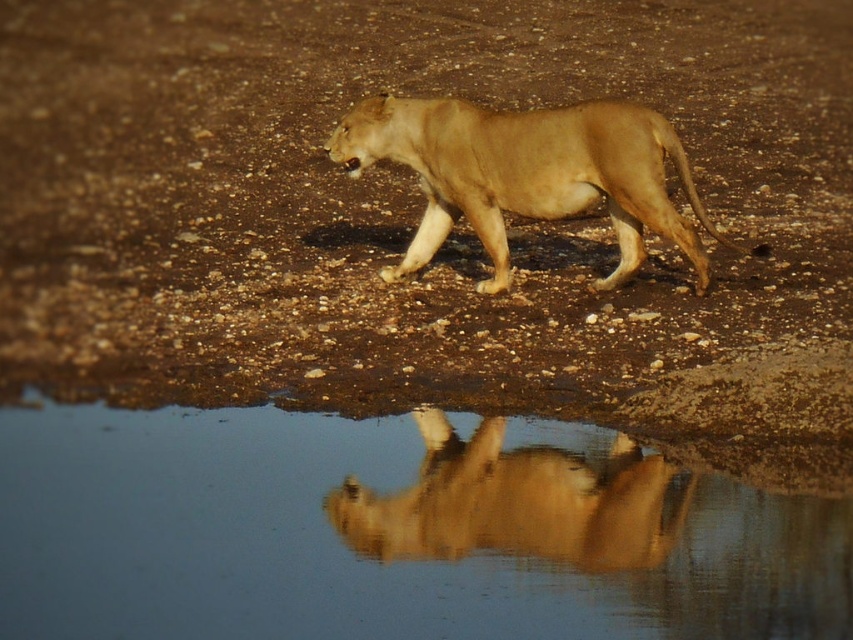
Question: Among these points, which one is nearest to the camera?

Choices:
 (A) (126, 280)
 (B) (425, 192)

Answer: (B)

Question: Which object is closer to the camera taking this photo?

Choices:
 (A) golden fur lioness at center
 (B) clear water at reflection center
 (C) golden fur lion at center

Answer: (B)

Question: Which of the following is the closest to the observer?

Choices:
 (A) (555, 211)
 (B) (590, 486)
 (C) (456, 419)

Answer: (B)

Question: Can you confirm if clear water at reflection center is bigger than golden fur lioness at center?

Choices:
 (A) yes
 (B) no

Answer: (A)

Question: In this image, where is clear water at reflection center located relative to golden fur lioness at center?

Choices:
 (A) below
 (B) above

Answer: (A)

Question: In this image, where is clear water at reflection center located relative to golden fur lioness at center?

Choices:
 (A) left
 (B) right

Answer: (A)